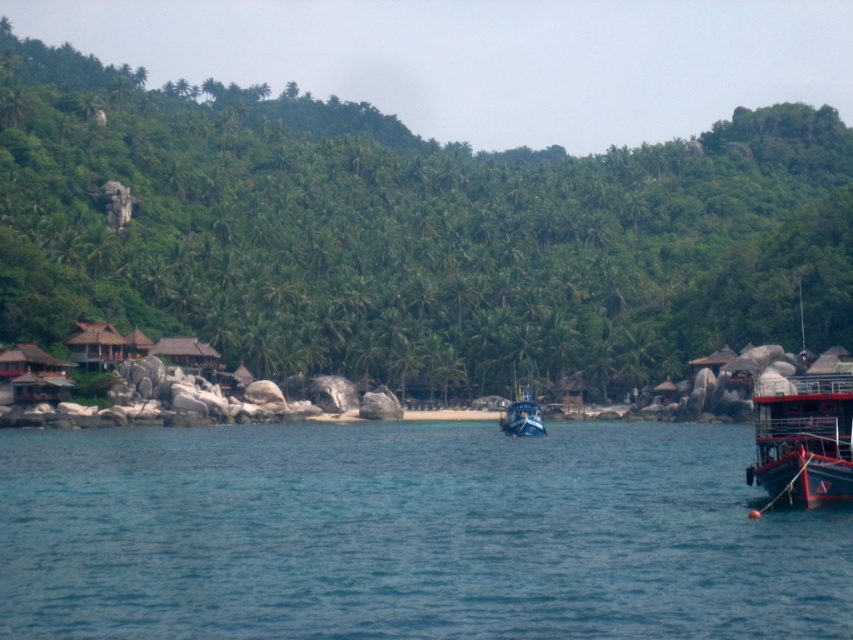
Question: Which object is positioned closest to the green leafy tree at center?

Choices:
 (A) red painted metal boat at right
 (B) blue water at center

Answer: (A)

Question: In this image, where is green leafy tree at center located relative to blue water at center?

Choices:
 (A) above
 (B) below

Answer: (A)

Question: Which of the following is the farthest from the observer?

Choices:
 (A) (90, 467)
 (B) (805, 387)
 (C) (527, 332)

Answer: (C)

Question: Can you confirm if green leafy tree at center is positioned to the right of blue water at center?

Choices:
 (A) yes
 (B) no

Answer: (B)

Question: Which of the following is the farthest from the observer?

Choices:
 (A) green leafy tree at center
 (B) red painted metal boat at right
 (C) blue water at center

Answer: (A)

Question: In this image, where is green leafy tree at center located relative to blue water at center?

Choices:
 (A) above
 (B) below

Answer: (A)